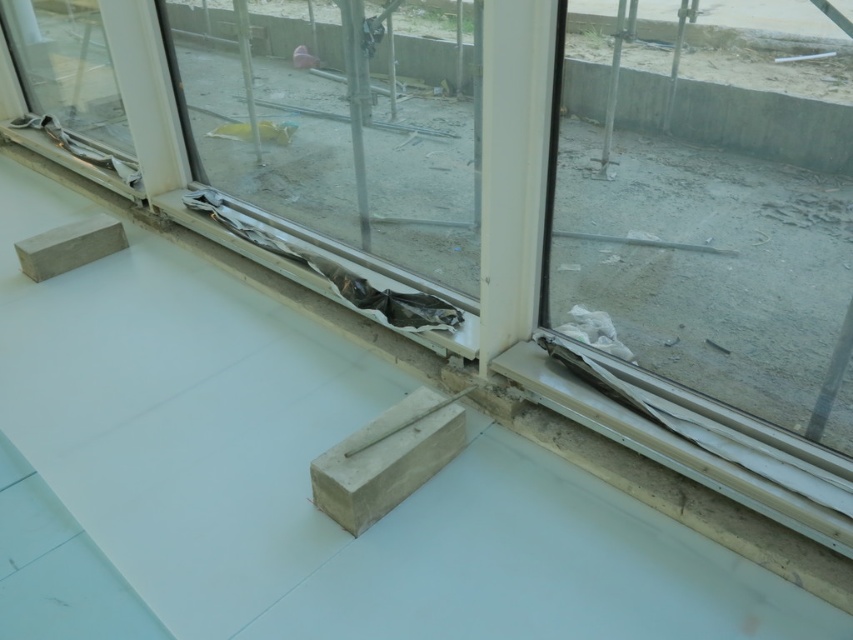
From the picture: You are a delivery person carrying a package that is 1.8 meters long. You need to walk through the path between the transparent glass door at right and the camera. Can you pass through without tilting the package?

The distance between the transparent glass door at right and the camera is 1.78 meters, which is shorter than the package length of 1.8 meters. Therefore, you cannot pass through without tilting the package.

You are a delivery person standing outside the construction site. You need to locate the transparent glass door at right. Based on the coordinates provided, where should you look to find it?

The transparent glass door at right is located at the coordinates point (711, 200).

You are a delivery person bringing a large package to the construction site. You need to choose between the transparent glass door at right and the transparent plastic glass door at center to pass through. Which door should you choose to ensure the package fits through without getting stuck?

You should choose the transparent plastic glass door at center because the transparent glass door at right occupies less space, meaning the transparent plastic glass door at center has more space and can accommodate the large package without getting stuck.